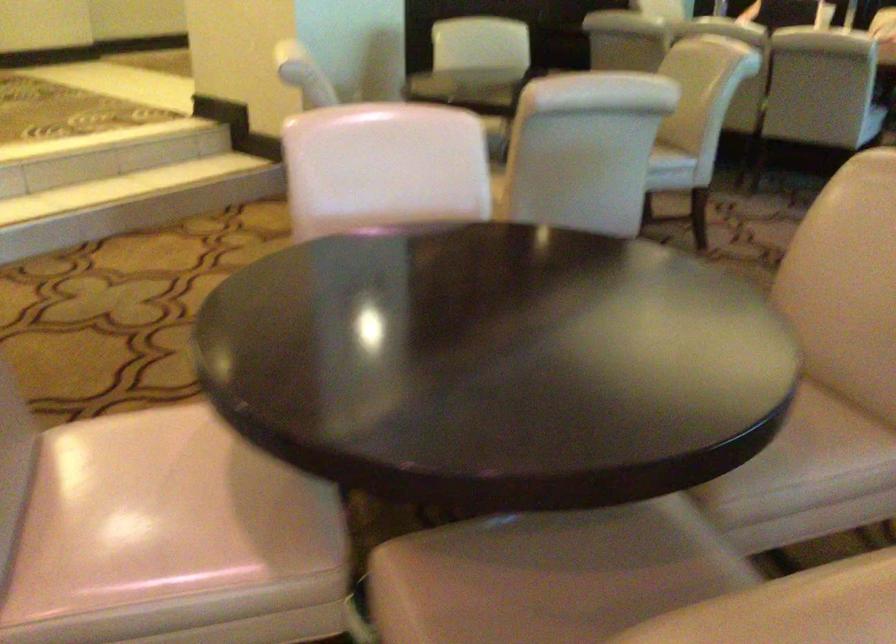
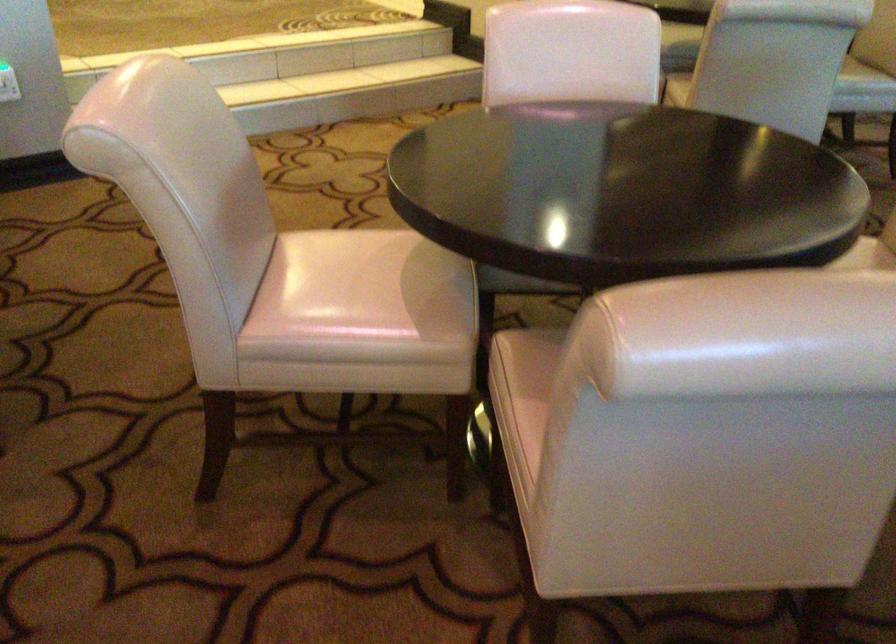
The point at (446, 576) is marked in the first image. Where is the corresponding point in the second image?

(538, 351)